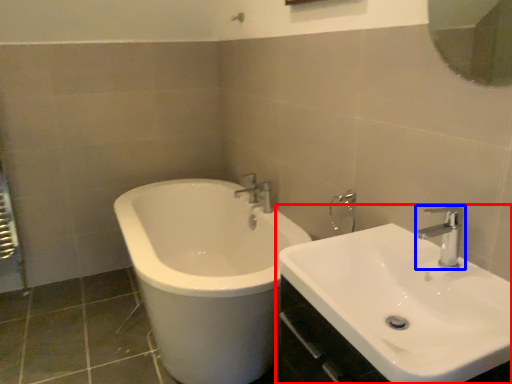
Question: Among these objects, which one is farthest to the camera, sink (highlighted by a red box) or tap (highlighted by a blue box)?

Choices:
 (A) sink
 (B) tap

Answer: (B)